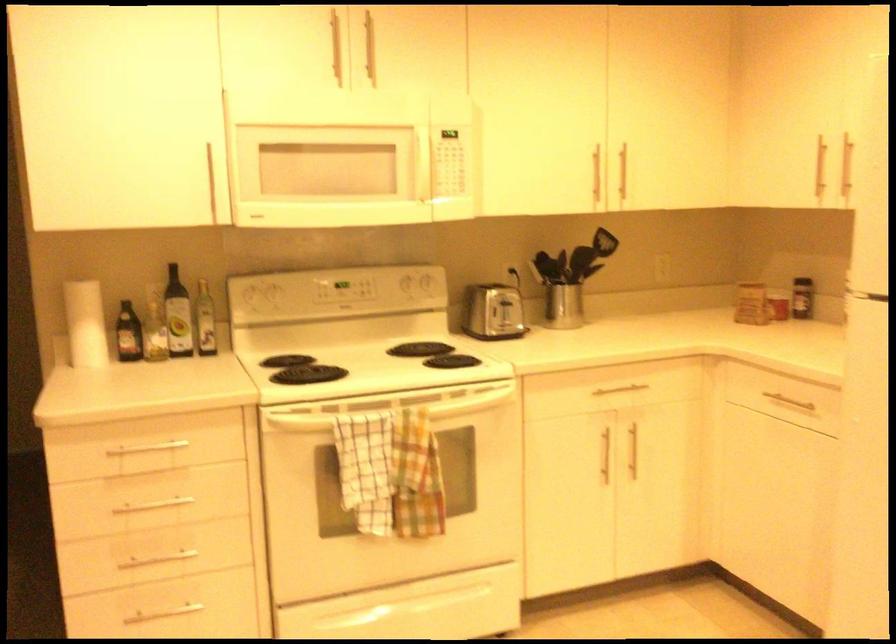
Which object does [177,315] point to?

It corresponds to the avocado oil bottle in the image.